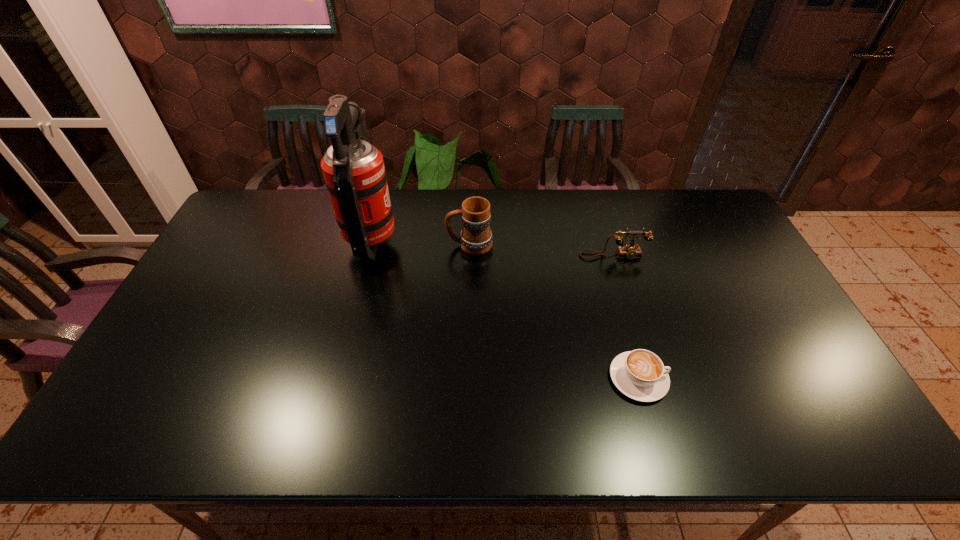
What are the coordinates of `free space located 0.170m on the side of the third shortest object with the handle` in the screenshot? It's located at (395, 245).

Identify the location of vacant space located on the front-facing side of the second shortest object. (631, 313).

You are a GUI agent. You are given a task and a screenshot of the screen. Output one action in this format:
    pyautogui.click(x=<x>, y=<y>)
    Task: Click on the vacant space located 0.240m on the side of the shortest object with the handle
    This screenshot has width=960, height=540.
    Given the screenshot: What is the action you would take?
    pyautogui.click(x=763, y=379)

Find the location of a particular element. The height and width of the screenshot is (540, 960). object located at the far edge is located at coordinates (353, 169).

At what (x,y) coordinates should I click in order to perform the action: click on free space at the far edge of the desktop. Please return your answer as a coordinate pair (x, y). The width and height of the screenshot is (960, 540). Looking at the image, I should click on (436, 189).

In the image, there is a desktop. Identify the location of vacant space at the near edge. (341, 441).

The height and width of the screenshot is (540, 960). Find the location of `free region at the right edge of the desktop`. free region at the right edge of the desktop is located at coordinates (x=774, y=354).

Where is `vacant space at the far right corner of the desktop`? Image resolution: width=960 pixels, height=540 pixels. vacant space at the far right corner of the desktop is located at coordinates (684, 200).

The image size is (960, 540). Find the location of `free space between the third object from right to left and the second shortest object`. free space between the third object from right to left and the second shortest object is located at coordinates (541, 251).

This screenshot has height=540, width=960. Find the location of `empty location between the fire extinguisher and the third tallest object`. empty location between the fire extinguisher and the third tallest object is located at coordinates (492, 248).